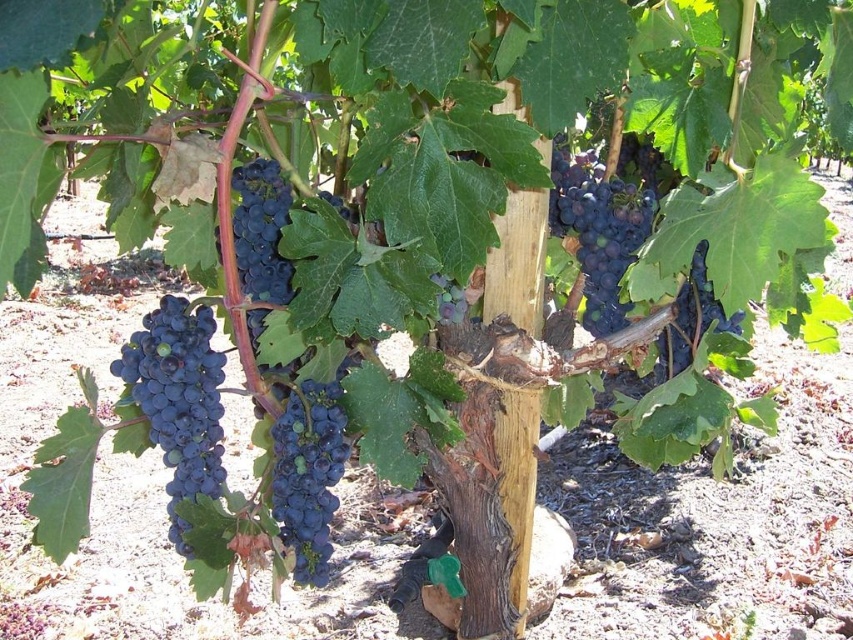
Question: Does shiny dark purple grapes at left lie in front of dark purple grapes at center?

Choices:
 (A) no
 (B) yes

Answer: (B)

Question: Can you confirm if shiny dark purple grapes at left is smaller than shiny dark purple grapes at center?

Choices:
 (A) yes
 (B) no

Answer: (A)

Question: Which point is closer to the camera?

Choices:
 (A) shiny dark purple grapes at center
 (B) shiny dark blue grapes at center
 (C) purple matte grapes at center

Answer: (C)

Question: Which is farther from the shiny purple grapes at center?

Choices:
 (A) shiny dark purple grapes at left
 (B) purple matte grapes at center
 (C) dark purple grapes at center

Answer: (A)

Question: Does dark purple grapes at center have a smaller size compared to purple matte grapes at center?

Choices:
 (A) no
 (B) yes

Answer: (A)

Question: Which of these objects is positioned farthest from the shiny dark blue grapes at center?

Choices:
 (A) shiny dark purple grapes at left
 (B) shiny dark purple grapes at center
 (C) purple matte grapes at center
 (D) shiny purple grapes at center

Answer: (D)